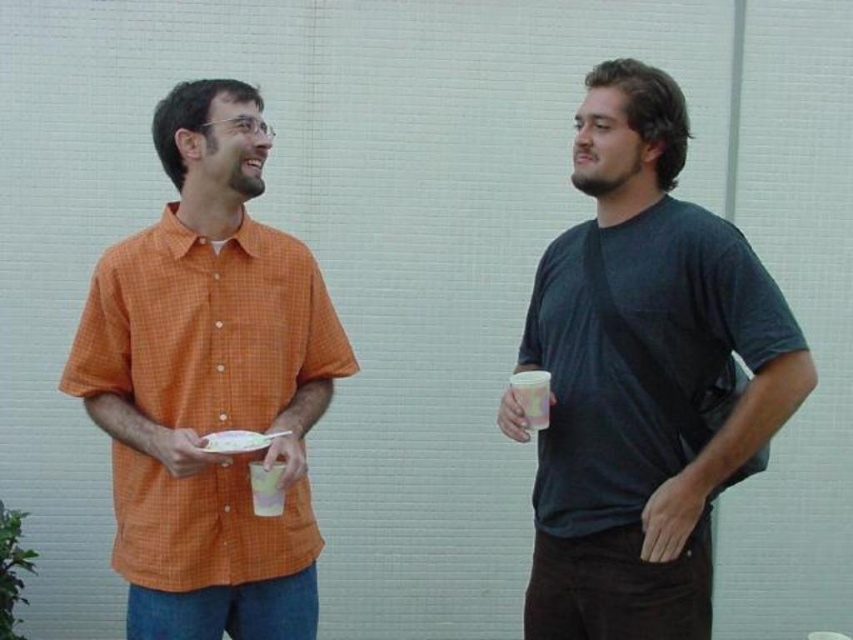
You are standing in the scene and want to place a small decoration between the two points, point (709, 298) and point (315, 307). To ensure it is visible from both points, where should you place it?

Place the decoration closer to point (709, 298) since it is in front of point (315, 307), making it visible from both positions.